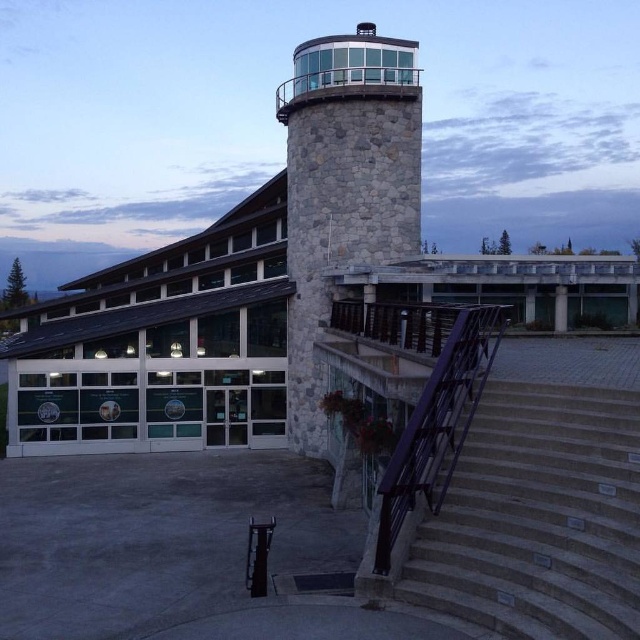
Does gray concrete stairs at lower right have a greater height compared to stone/tile control tower at center?

No, gray concrete stairs at lower right is not taller than stone/tile control tower at center.

Does gray concrete stairs at lower right have a lesser width compared to stone/tile control tower at center?

Correct, gray concrete stairs at lower right's width is less than stone/tile control tower at center's.

At what (x,y) coordinates should I click in order to perform the action: click on gray concrete stairs at lower right. Please return your answer as a coordinate pair (x, y). Looking at the image, I should click on (538, 516).